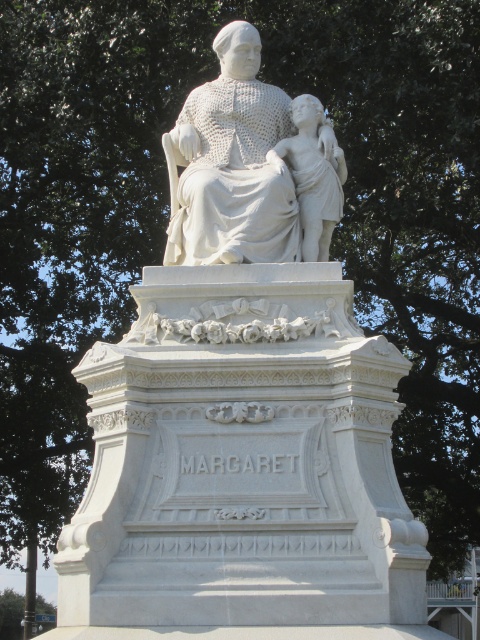
In the scene shown: You are a park visitor standing in front of the white marble statue at center. You notice the white marble child at center nearby. Which one is positioned higher up?

The white marble statue at center is positioned higher up than the white marble child at center.

You are an artist planning to sketch the scene. You need to ensure your canvas can accommodate both the white marble statue at center and the green leafy tree at lower left. Based on their widths, which object requires a wider space on the canvas?

The white marble statue at center requires a wider space on the canvas because it might be wider than the green leafy tree at lower left.